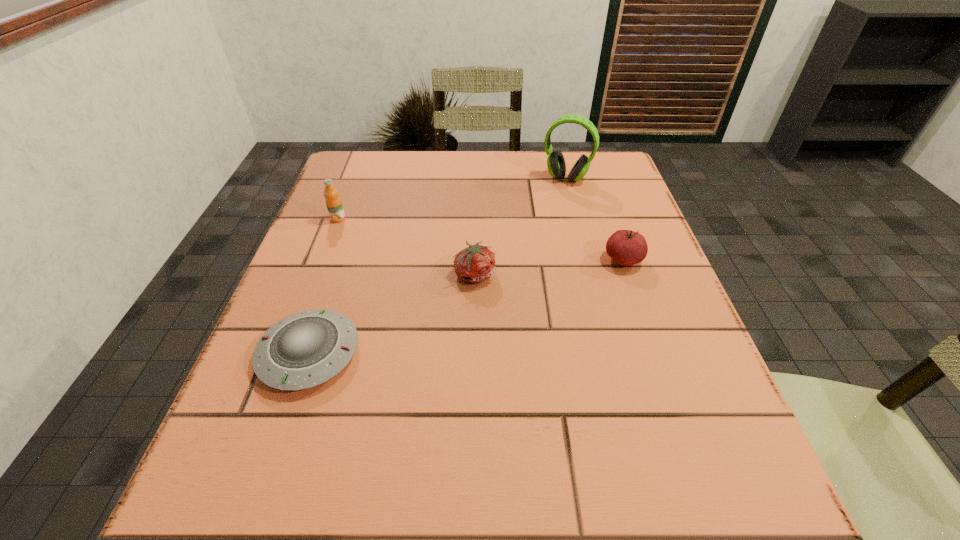
Identify the location of free location at the near edge of the desktop. The width and height of the screenshot is (960, 540). (562, 485).

Locate an element on the screen. The image size is (960, 540). vacant area at the left edge of the desktop is located at coordinates (314, 241).

I want to click on vacant area at the right edge, so click(719, 440).

Locate an element on the screen. Image resolution: width=960 pixels, height=540 pixels. free space at the near left corner of the desktop is located at coordinates (182, 521).

At what (x,y) coordinates should I click in order to perform the action: click on vacant region at the far right corner of the desktop. Please return your answer as a coordinate pair (x, y). The width and height of the screenshot is (960, 540). Looking at the image, I should click on (616, 186).

In order to click on vacant region between the right tomato and the headset in this screenshot , I will do `click(594, 219)`.

The height and width of the screenshot is (540, 960). I want to click on free space between the saucer and the tallest object, so click(x=438, y=266).

What are the coordinates of `unoccupied area between the third object from left to right and the nearest object` in the screenshot? It's located at (393, 314).

Where is `vacant point located between the right tomato and the orange juice`? vacant point located between the right tomato and the orange juice is located at coordinates click(481, 239).

The height and width of the screenshot is (540, 960). In order to click on unoccupied area between the right tomato and the third object from right to left in this screenshot , I will do `click(549, 267)`.